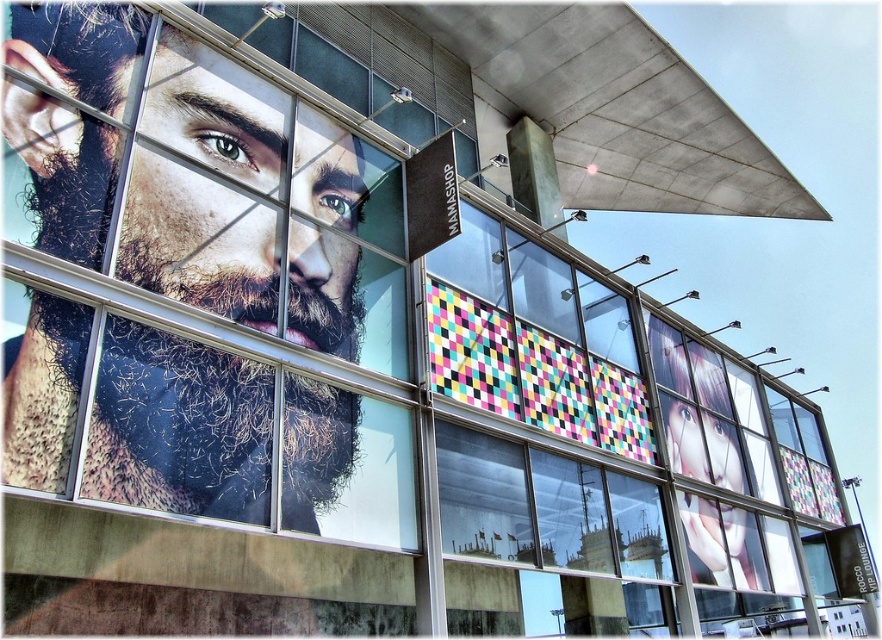
You are an artist analyzing the building facade. You notice the realistic skin portrait at upper left and the multicolored mosaic tiles at center. Which one has a greater vertical height?

The realistic skin portrait at upper left is taller than the multicolored mosaic tiles at center.

You are standing in front of the building and want to take a photo of both the realistic skin portrait at upper left and the multicolored mosaic tiles at center. Given that your camera can only focus on objects within a 10 feet range, will both objects be in focus?

The realistic skin portrait at upper left is 8.87 feet away from the multicolored mosaic tiles at center. Since the distance between them is within the camera focus range of 10 feet, both objects will be in focus.

You are an artist standing in front of the building and want to sketch the advertisements. Which object, the beige textured beard at left or the multicolored mosaic tiles at center, should you focus on first if you want to start with the one nearest to you?

The beige textured beard at left is closer to the viewer than the multicolored mosaic tiles at center, so you should focus on the beige textured beard at left first.